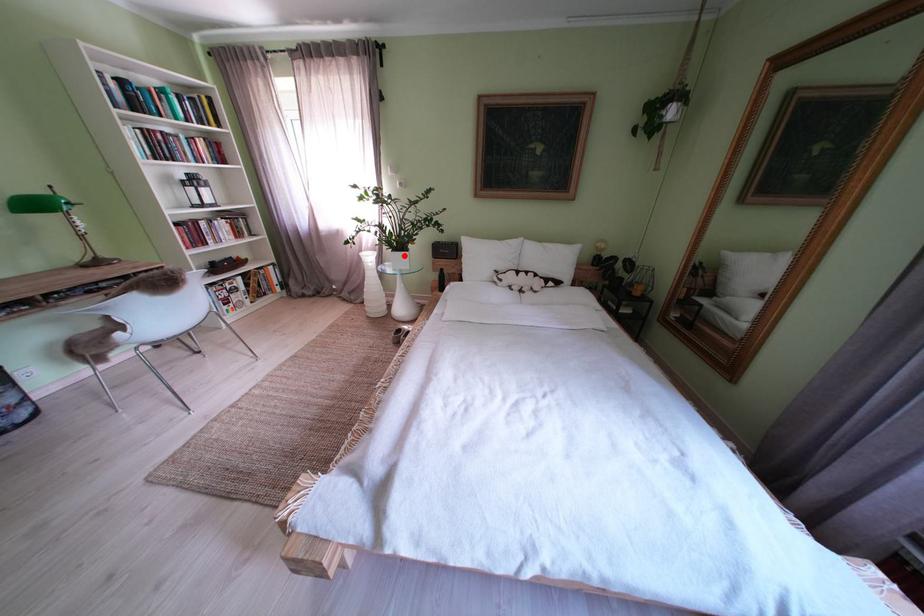
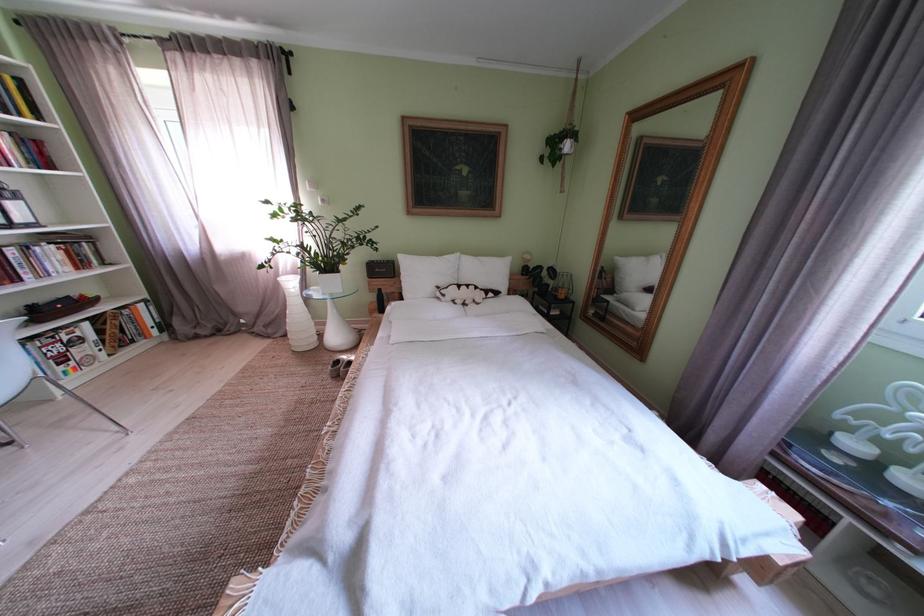
Find the pixel in the second image that matches the highlighted location in the first image.

(333, 278)